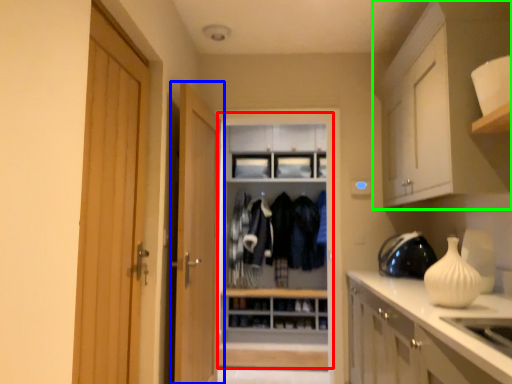
Question: Estimate the real-world distances between objects in this image. Which object is farther from dresser (highlighted by a red box), door (highlighted by a blue box) or cabinetry (highlighted by a green box)?

Choices:
 (A) door
 (B) cabinetry

Answer: (B)